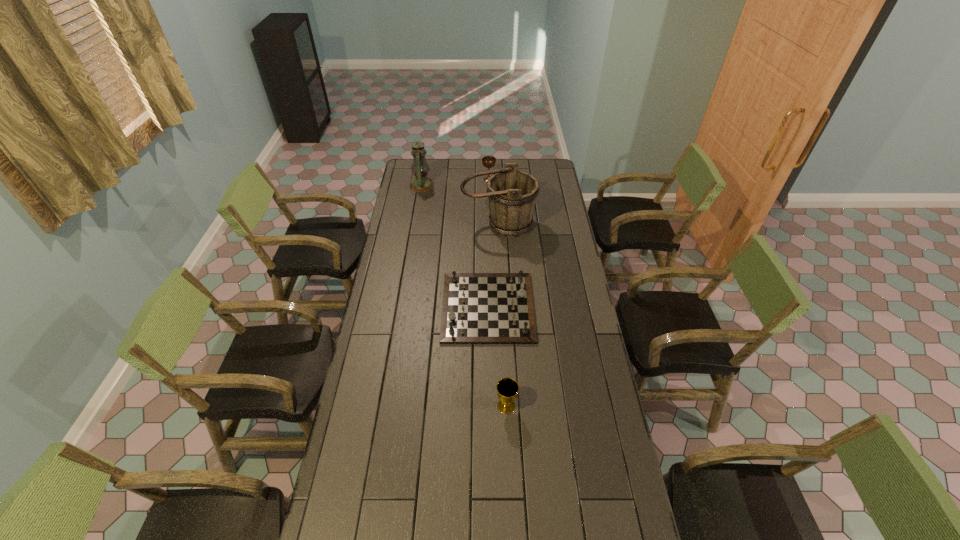
Locate an element on the screen. The height and width of the screenshot is (540, 960). free space located on the board of the chessboard is located at coordinates (420, 307).

Locate an element on the screen. The width and height of the screenshot is (960, 540). free location located 0.240m on the board of the chessboard is located at coordinates (387, 307).

The image size is (960, 540). I want to click on free location located 0.300m on the board of the chessboard, so click(373, 307).

Where is `oil lamp located in the far edge section of the desktop`? oil lamp located in the far edge section of the desktop is located at coordinates (421, 183).

Locate an element on the screen. The width and height of the screenshot is (960, 540). chalice that is at the far edge is located at coordinates (488, 161).

This screenshot has height=540, width=960. I want to click on object that is at the left edge, so click(x=421, y=183).

What are the coordinates of `object present at the far left corner` in the screenshot? It's located at (421, 183).

Identify the location of free region at the left edge of the desktop. pos(399,344).

This screenshot has height=540, width=960. In the image, there is a desktop. Identify the location of vacant space at the right edge. (559, 352).

Find the location of a particular element. unoccupied position between the farther chalice and the shortest object is located at coordinates (489, 244).